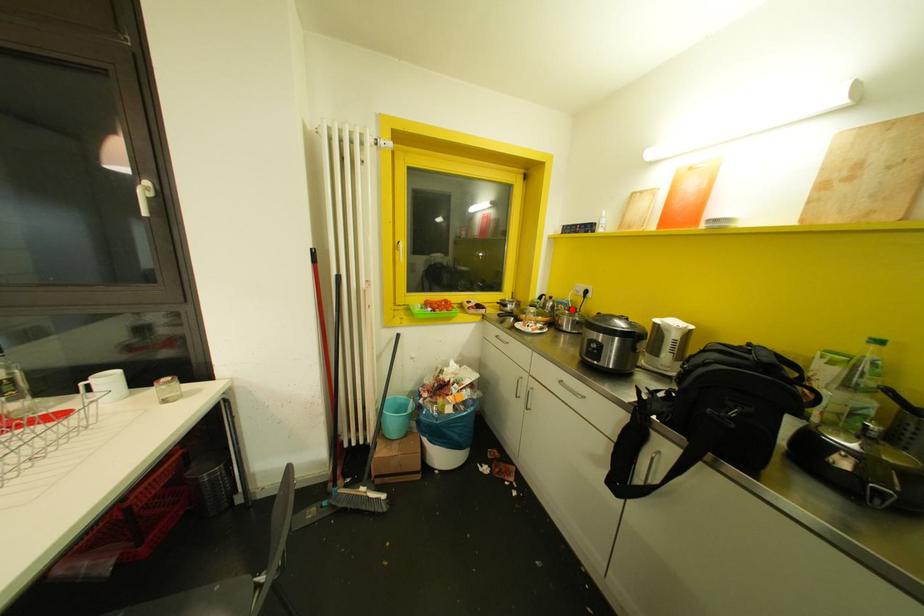
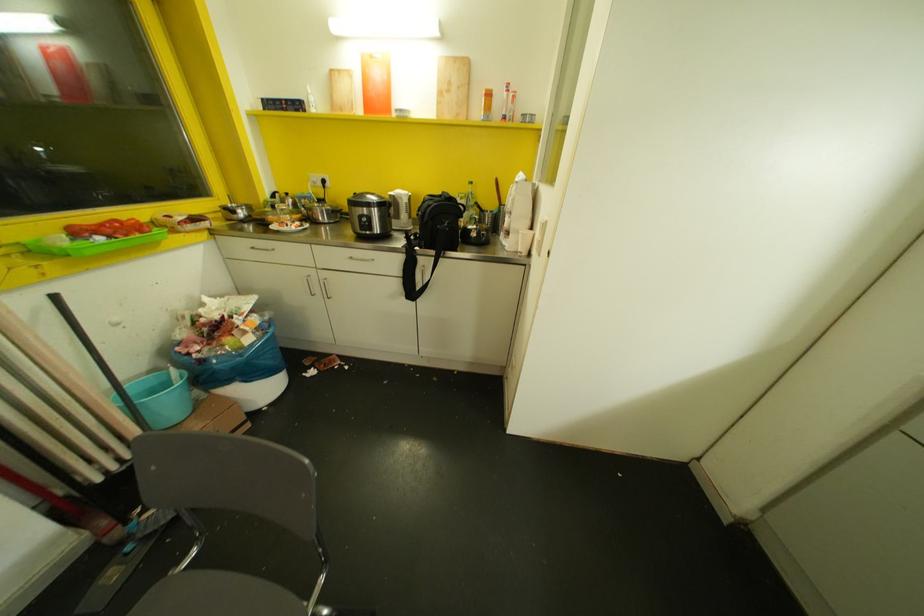
Locate, in the second image, the point that corresponds to the highlighted location in the first image.

(320, 200)